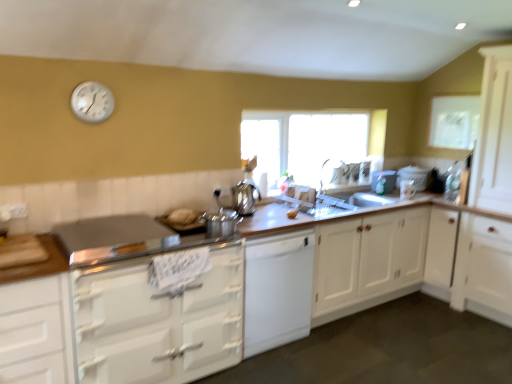
Question: Considering the relative sizes of silver metallic clock at upper left and white paper at upper right in the image provided, is silver metallic clock at upper left wider than white paper at upper right?

Choices:
 (A) yes
 (B) no

Answer: (A)

Question: Considering the relative sizes of silver metallic clock at upper left and white paper at upper right in the image provided, is silver metallic clock at upper left bigger than white paper at upper right?

Choices:
 (A) no
 (B) yes

Answer: (A)

Question: Is the position of silver metallic clock at upper left less distant than that of white paper at upper right?

Choices:
 (A) yes
 (B) no

Answer: (A)

Question: Does silver metallic clock at upper left lie behind white paper at upper right?

Choices:
 (A) no
 (B) yes

Answer: (A)

Question: Is silver metallic clock at upper left facing towards white paper at upper right?

Choices:
 (A) yes
 (B) no

Answer: (B)

Question: Is silver metallic clock at upper left facing away from white paper at upper right?

Choices:
 (A) yes
 (B) no

Answer: (B)

Question: Is white glossy cabinet at lower left, marked as the 4th cabinetry in a right-to-left arrangement, thinner than white wood cabinet at center, the first cabinetry in the right-to-left sequence?

Choices:
 (A) yes
 (B) no

Answer: (B)

Question: From the image's perspective, does white glossy cabinet at lower left, marked as the 4th cabinetry in a right-to-left arrangement, appear lower than white wood cabinet at center, the first cabinetry in the right-to-left sequence?

Choices:
 (A) no
 (B) yes

Answer: (B)

Question: Considering the relative sizes of white glossy cabinet at lower left, marked as the 4th cabinetry in a right-to-left arrangement, and white wood cabinet at center, the first cabinetry in the right-to-left sequence, in the image provided, is white glossy cabinet at lower left, marked as the 4th cabinetry in a right-to-left arrangement, taller than white wood cabinet at center, the first cabinetry in the right-to-left sequence,?

Choices:
 (A) yes
 (B) no

Answer: (B)

Question: Is there a large distance between white glossy cabinet at lower left, marked as the 4th cabinetry in a right-to-left arrangement, and white wood cabinet at center, acting as the fourth cabinetry starting from the left?

Choices:
 (A) no
 (B) yes

Answer: (B)

Question: Considering the relative sizes of white glossy cabinet at lower left, which appears as the 1th cabinetry when viewed from the left, and white wood cabinet at center, the first cabinetry in the right-to-left sequence, in the image provided, is white glossy cabinet at lower left, which appears as the 1th cabinetry when viewed from the left, smaller than white wood cabinet at center, the first cabinetry in the right-to-left sequence,?

Choices:
 (A) yes
 (B) no

Answer: (A)

Question: Are white glossy cabinet at lower left, marked as the 4th cabinetry in a right-to-left arrangement, and white wood cabinet at center, the first cabinetry in the right-to-left sequence, beside each other?

Choices:
 (A) yes
 (B) no

Answer: (B)

Question: From a real-world perspective, is white wood cabinet at center, the first cabinetry in the right-to-left sequence, below yellow matte apple at center?

Choices:
 (A) no
 (B) yes

Answer: (B)